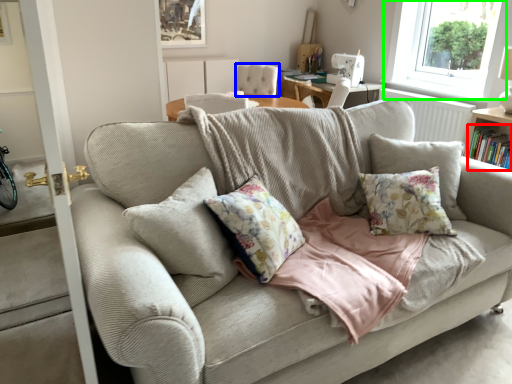
Question: Which is farther away from book (highlighted by a red box)? armchair (highlighted by a blue box) or window (highlighted by a green box)?

Choices:
 (A) armchair
 (B) window

Answer: (B)